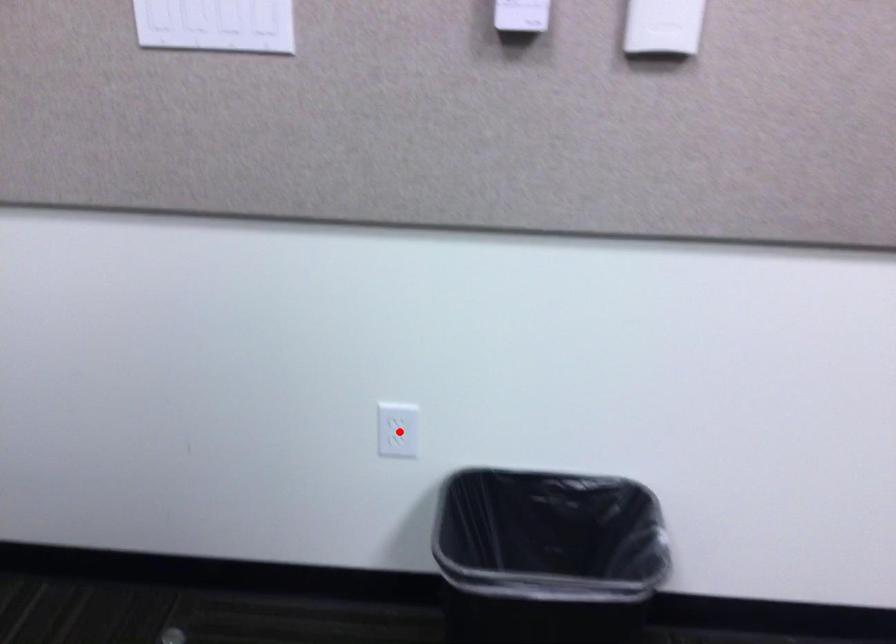
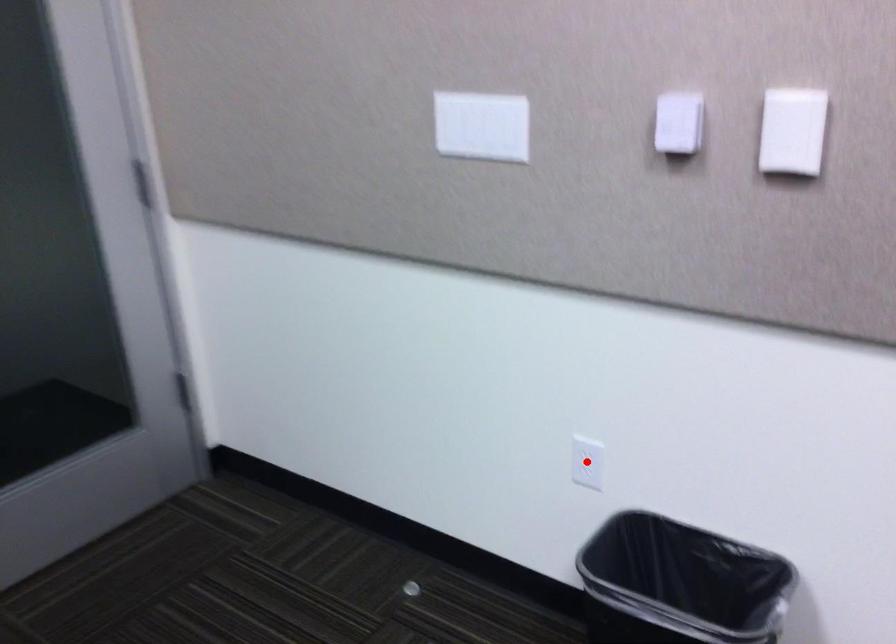
I am providing you with two images of the same scene from different viewpoints. A red point is marked on the first image and another point is marked on the second image. Does the point marked in image1 correspond to the same location as the one in image2?

Yes